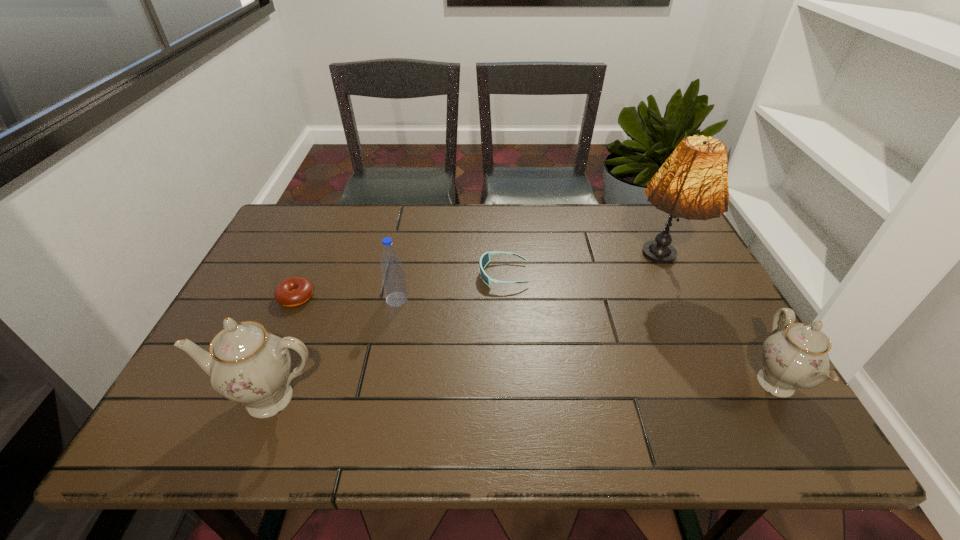
The width and height of the screenshot is (960, 540). What are the coordinates of `object located at the near right corner` in the screenshot? It's located at (797, 356).

Find the location of a particular element. The height and width of the screenshot is (540, 960). vacant point at the far edge is located at coordinates [625, 244].

Identify the location of free point at the near edge. This screenshot has width=960, height=540. (439, 404).

Where is `vacant position at the left edge of the desktop`? This screenshot has width=960, height=540. vacant position at the left edge of the desktop is located at coordinates (261, 268).

This screenshot has height=540, width=960. Find the location of `free space at the right edge`. free space at the right edge is located at coordinates (689, 289).

In the image, there is a desktop. What are the coordinates of `vacant space at the far right corner` in the screenshot? It's located at (631, 205).

You are a GUI agent. You are given a task and a screenshot of the screen. Output one action in this format:
    pyautogui.click(x=<x>, y=<y>)
    Task: Click on the free spot between the tallest object and the doughnut
    The height and width of the screenshot is (540, 960).
    Given the screenshot: What is the action you would take?
    pyautogui.click(x=477, y=283)

Where is `free space between the fourth object from right to left and the doughnut`? Image resolution: width=960 pixels, height=540 pixels. free space between the fourth object from right to left and the doughnut is located at coordinates (347, 299).

Locate an element on the screen. The height and width of the screenshot is (540, 960). free space between the third object from left to right and the goggles is located at coordinates click(450, 287).

The height and width of the screenshot is (540, 960). I want to click on free point between the fourth object from left to right and the water bottle, so click(450, 287).